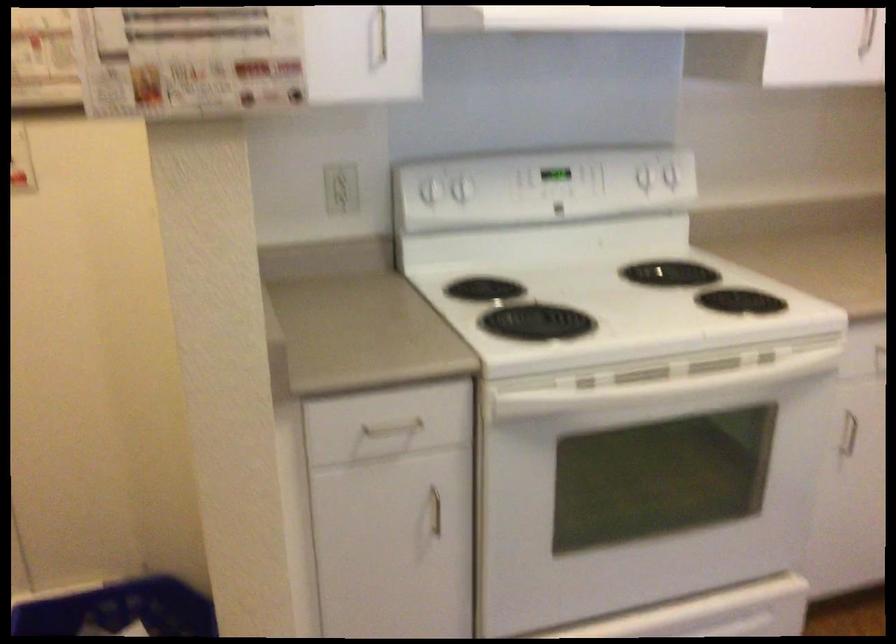
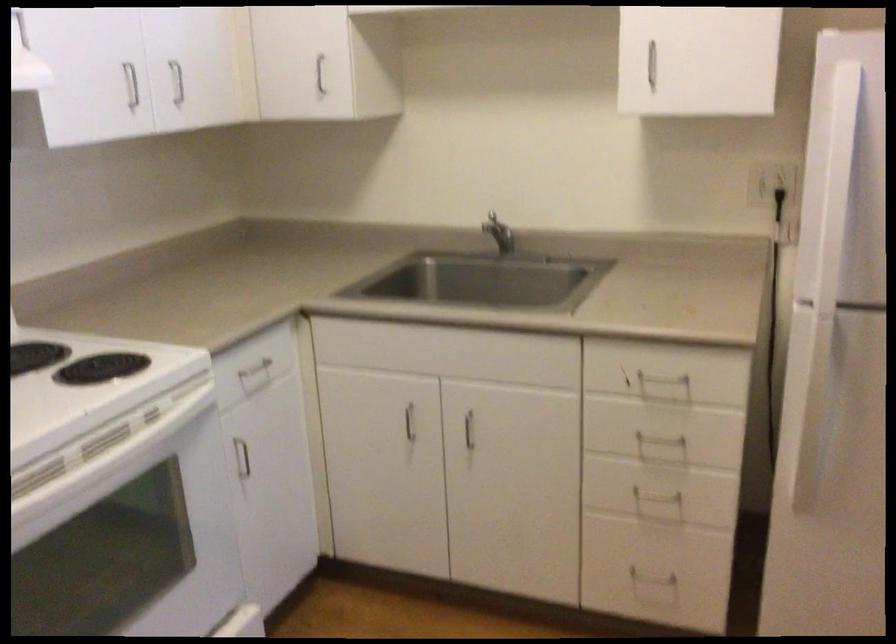
Where in the second image is the point corresponding to point (711, 386) from the first image?

(108, 459)